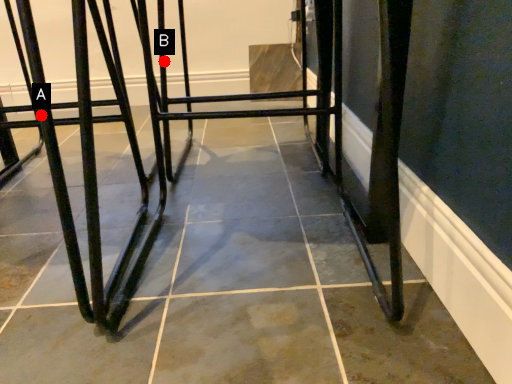
Question: Two points are circled on the image, labeled by A and B beside each circle. Which point is closer to the camera?

Choices:
 (A) A is closer
 (B) B is closer

Answer: (A)